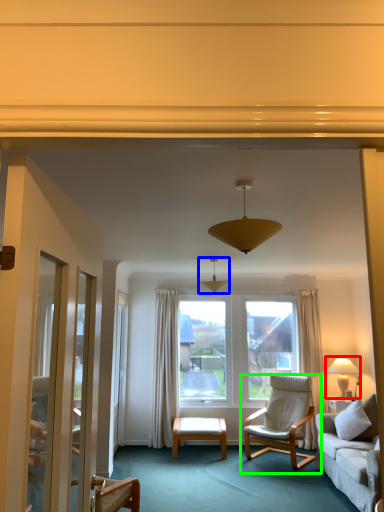
Question: Which object is the closest to the lamp (highlighted by a red box)? Choose among these: lamp (highlighted by a blue box) or chair (highlighted by a green box).

Choices:
 (A) lamp
 (B) chair

Answer: (B)